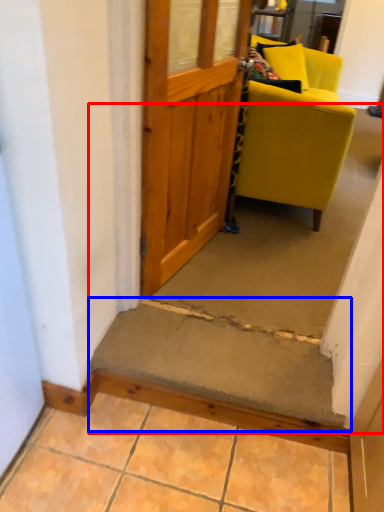
Question: Among these objects, which one is nearest to the camera, stairwell (highlighted by a red box) or stairwell (highlighted by a blue box)?

Choices:
 (A) stairwell
 (B) stairwell

Answer: (B)